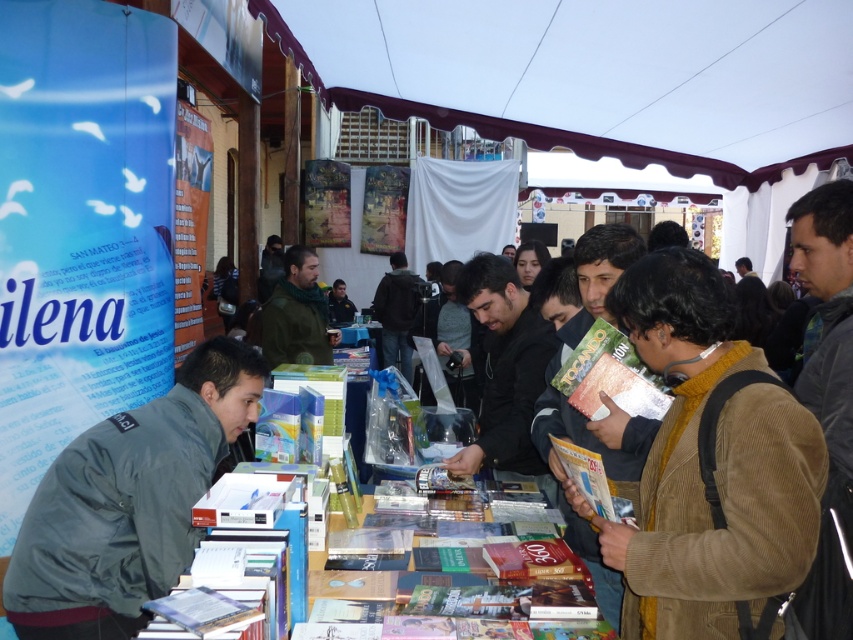
You are a vendor at the book fair and need to decide which jacket to wear for the event. Both the black matte jacket at center and the green corduroy jacket at center are available. If you want to choose the wider jacket to look more professional, which one should you pick?

The green corduroy jacket at center is wider than the black matte jacket at center, so you should choose the green corduroy jacket at center to look more professional.

You are a photographer standing at the corner of the book fair. You want to take a photo of the brown corduroy jacket at center. What are the coordinates of the jacket to frame it properly?

The coordinates of the brown corduroy jacket at center are at point (593, 436).

You are standing at the book fair and want to take a photo of the two points mentioned. Which point, point (125, 621) or point (413, 284), will appear larger in your camera view?

Point (125, 621) is closer to the camera than point (413, 284), so it will appear larger in the camera view.